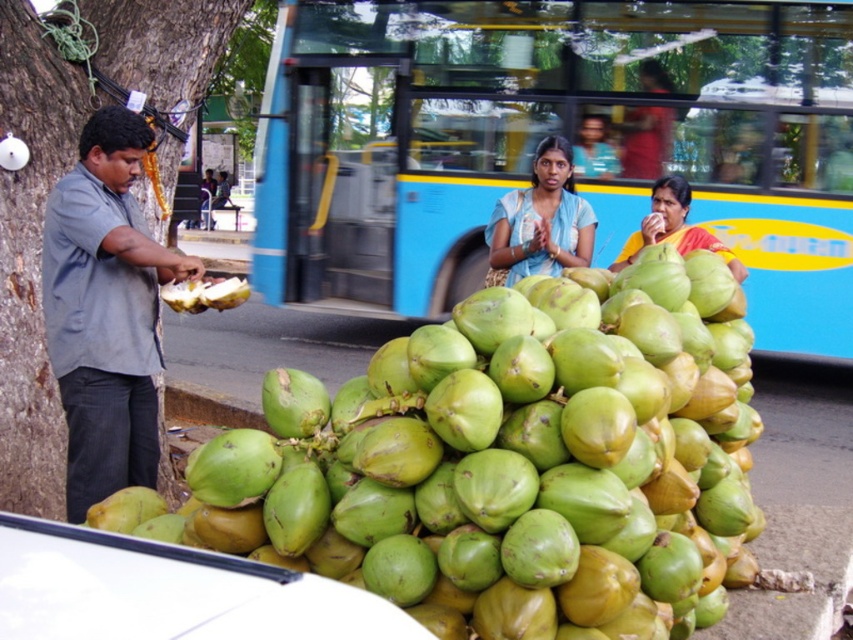
Measure the distance between blue painted bus at center and gray shirt at left.

They are 23.36 feet apart.

Is point (602, 17) more distant than point (96, 355)?

Yes, point (602, 17) is farther from viewer.

The height and width of the screenshot is (640, 853). I want to click on blue painted bus at center, so click(554, 132).

I want to click on blue painted bus at center, so click(x=554, y=132).

Does blue painted bus at center have a lesser width compared to blue fabric woman at center?

Correct, blue painted bus at center's width is less than blue fabric woman at center's.

Does blue painted bus at center appear over blue fabric woman at center?

Yes.

Is point (311, 86) farther from viewer compared to point (564, 236)?

Yes, it is behind point (564, 236).

Identify the location of blue painted bus at center. The height and width of the screenshot is (640, 853). (554, 132).

Who is positioned more to the right, blue fabric woman at center or white matte coconut at center?

blue fabric woman at center is more to the right.

Between blue fabric woman at center and white matte coconut at center, which one is positioned lower?

Positioned lower is white matte coconut at center.

Does point (496, 244) come behind point (206, 308)?

Yes, point (496, 244) is behind point (206, 308).

Find the location of a particular element. This screenshot has height=640, width=853. blue fabric woman at center is located at coordinates (540, 221).